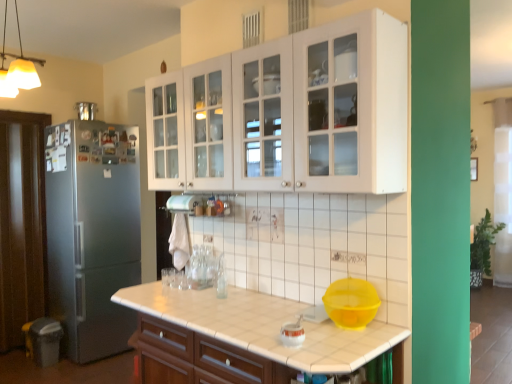
Question: In terms of height, does brushed metal refrigerator at left, acting as the second appliance starting from the bottom, look taller or shorter compared to matte white countertop at center, marked as the 1th cabinetry in a bottom-to-top arrangement?

Choices:
 (A) tall
 (B) short

Answer: (B)

Question: Is brushed metal refrigerator at left, arranged as the second appliance when viewed from the right, inside the boundaries of matte white countertop at center, the 2th cabinetry from the top, or outside?

Choices:
 (A) outside
 (B) inside

Answer: (A)

Question: Which object is the closest to the satin silver refrigerator at left?

Choices:
 (A) matte white countertop at center, marked as the 1th cabinetry in a bottom-to-top arrangement
 (B) brushed metal refrigerator at left, which is the second appliance in front-to-back order
 (C) white glossy kettle at center, placed as the second appliance when sorted from left to right
 (D) white glossy cabinet at upper center, arranged as the 2th cabinetry when ordered from the bottom
 (E) yellow plastic mixing bowl at lower center

Answer: (B)

Question: Based on their relative distances, which object is farther from the white glossy cabinet at upper center, which is the 1th cabinetry in top-to-bottom order?

Choices:
 (A) brushed metal refrigerator at left, placed as the first appliance when sorted from top to bottom
 (B) white glossy kettle at center, positioned as the 2th appliance in top-to-bottom order
 (C) matte white countertop at center, marked as the 1th cabinetry in a bottom-to-top arrangement
 (D) satin silver refrigerator at left
 (E) yellow plastic mixing bowl at lower center

Answer: (A)